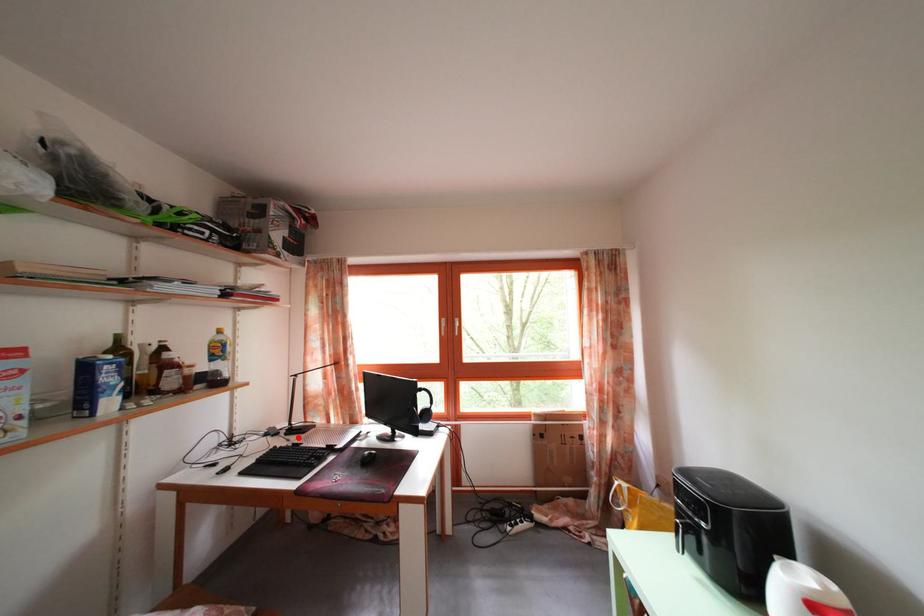
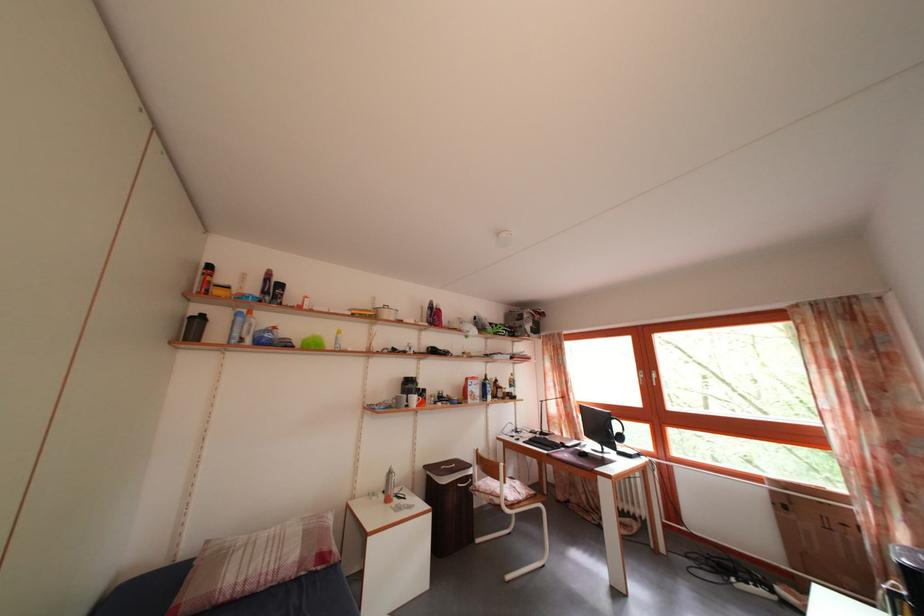
Question: I am providing you with two images of the same scene from different viewpoints. A red point is shown in image1. For the corresponding object point in image2, is it positioned nearer or farther from the camera?

Choices:
 (A) Nearer
 (B) Farther

Answer: (B)